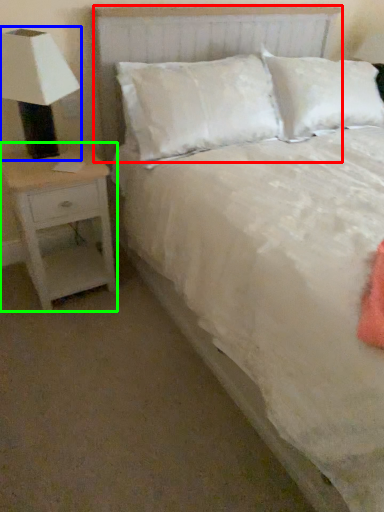
Question: Considering the real-world distances, which object is farthest from headboard (highlighted by a red box)? lamp (highlighted by a blue box) or nightstand (highlighted by a green box)?

Choices:
 (A) lamp
 (B) nightstand

Answer: (B)